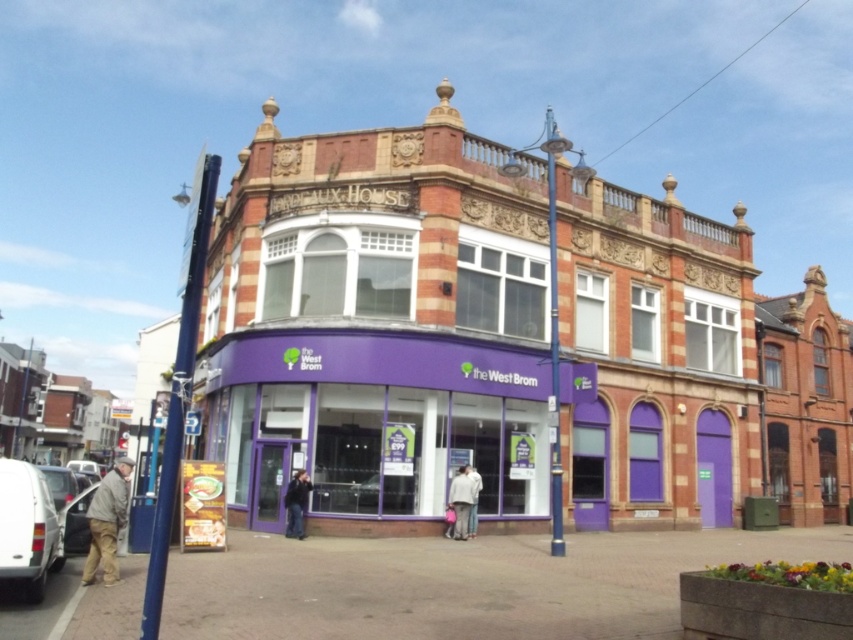
Which is in front, point (294, 348) or point (433, 358)?

Positioned in front is point (433, 358).

Does purple matte building at center appear under purple matte bank at center?

Incorrect, purple matte building at center is not positioned below purple matte bank at center.

Is point (558, 202) more distant than point (543, 438)?

Yes, point (558, 202) is behind point (543, 438).

Where is `purple matte building at center`? purple matte building at center is located at coordinates (379, 323).